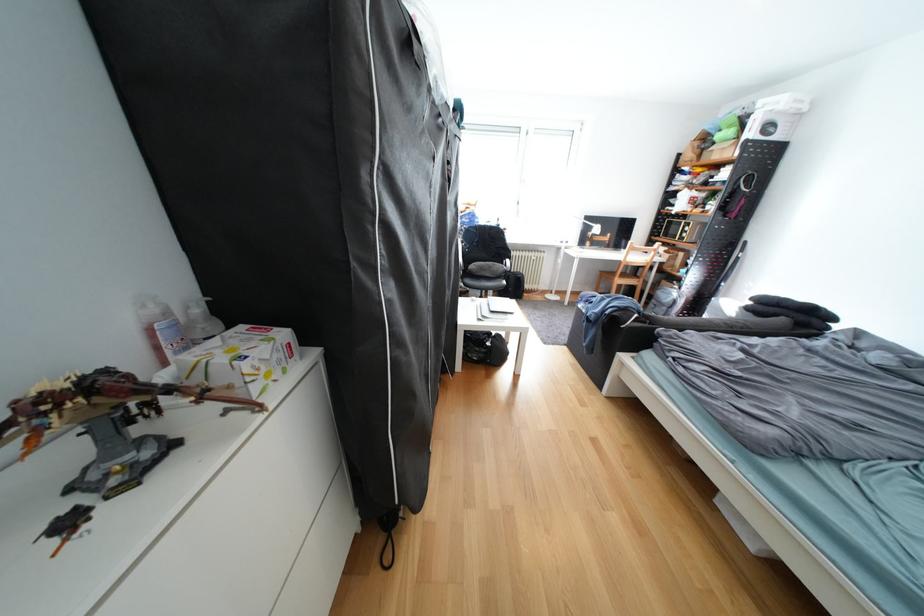
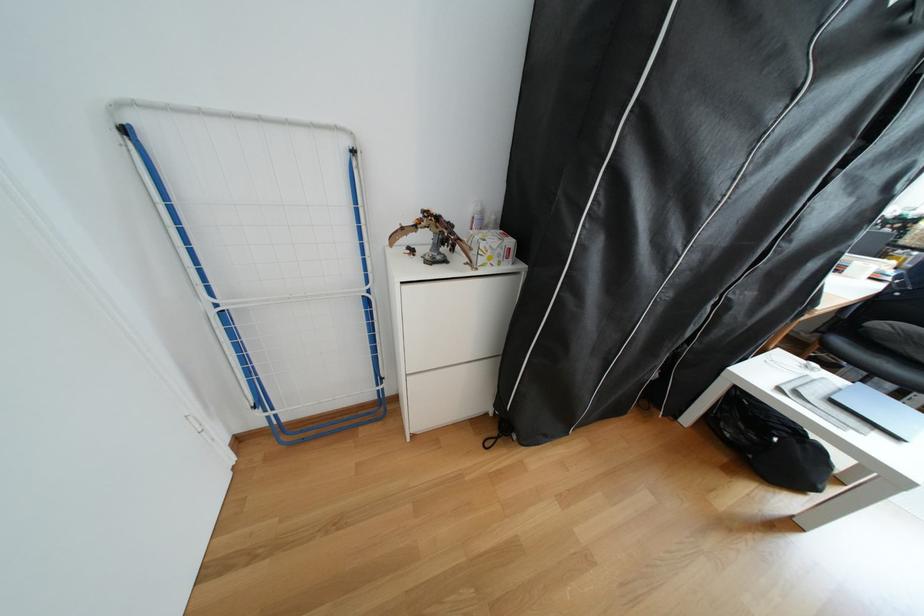
The point at [485,267] is marked in the first image. Where is the corresponding point in the second image?

(894, 326)